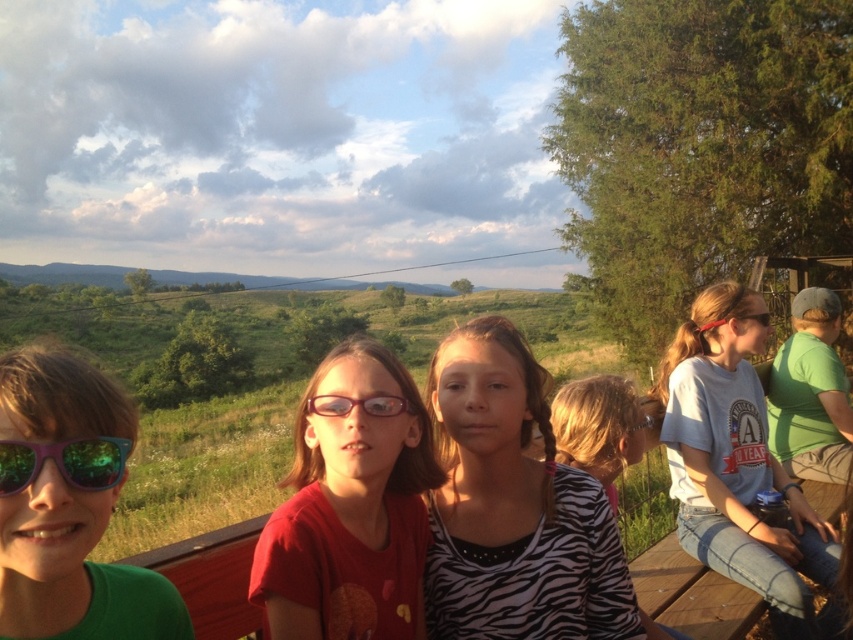
Is point (399, 426) positioned after point (9, 480)?

Yes, point (399, 426) is farther from viewer.

The width and height of the screenshot is (853, 640). What do you see at coordinates (350, 509) in the screenshot?
I see `matte red shirt at center` at bounding box center [350, 509].

Is point (369, 541) in front of point (53, 352)?

That is False.

Locate an element on the screen. This screenshot has width=853, height=640. matte red shirt at center is located at coordinates (350, 509).

Can you confirm if matte green sunglasses at left is positioned above white cotton shirt at right?

Indeed, matte green sunglasses at left is positioned over white cotton shirt at right.

Does matte green sunglasses at left have a greater width compared to white cotton shirt at right?

No.

Where is `matte green sunglasses at left`? This screenshot has width=853, height=640. matte green sunglasses at left is located at coordinates (68, 508).

Who is more distant from viewer, (543,577) or (129,442)?

The point (543,577) is more distant.

Between zebra print shirt at center and shiny green sunglasses at left, which one appears on the left side from the viewer's perspective?

From the viewer's perspective, shiny green sunglasses at left appears more on the left side.

Which is in front, point (534, 532) or point (27, 476)?

Point (27, 476) is more forward.

This screenshot has height=640, width=853. Identify the location of zebra print shirt at center. (514, 508).